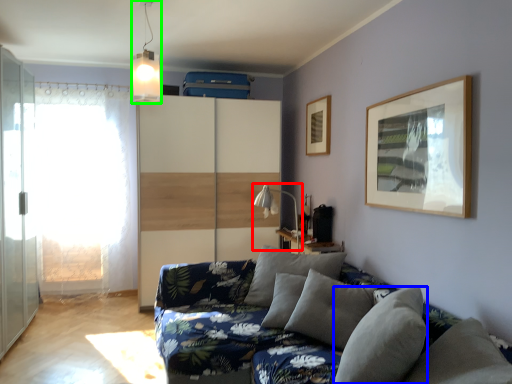
Question: Based on their relative distances, which object is farther from table lamp (highlighted by a red box)? Choose from pillow (highlighted by a blue box) and light fixture (highlighted by a green box).

Choices:
 (A) pillow
 (B) light fixture

Answer: (A)